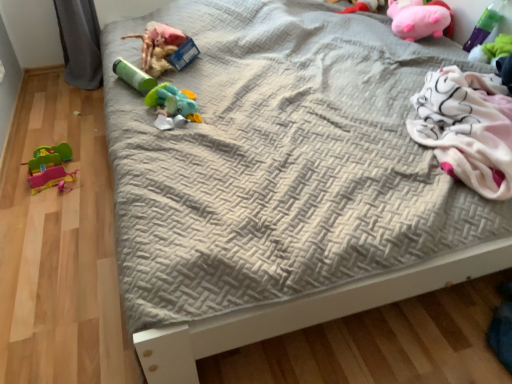
Question: Would you say rubber duck at left, acting as the first toy starting from the left, is part of rubberized green and blue toy at center, the fourth toy in the left-to-right sequence,'s contents?

Choices:
 (A) no
 (B) yes

Answer: (A)

Question: Can you confirm if rubberized green and blue toy at center, the fourth toy in the left-to-right sequence, is shorter than rubber duck at left, acting as the first toy starting from the left?

Choices:
 (A) no
 (B) yes

Answer: (B)

Question: Is rubberized green and blue toy at center, the fourth toy in the left-to-right sequence, far from rubber duck at left, which is the seventh toy in right-to-left order?

Choices:
 (A) yes
 (B) no

Answer: (B)

Question: Does rubberized green and blue toy at center, which is the fourth toy in right-to-left order, have a smaller size compared to rubber duck at left, acting as the first toy starting from the left?

Choices:
 (A) yes
 (B) no

Answer: (A)

Question: Does rubberized green and blue toy at center, the fourth toy in the left-to-right sequence, have a greater width compared to rubber duck at left, which is the seventh toy in right-to-left order?

Choices:
 (A) no
 (B) yes

Answer: (B)

Question: Looking at their shapes, would you say pink plush toy at upper right, which appears as the fifth toy when viewed from the left, is wider or thinner than rubberized green and blue toy at center, which is the fourth toy in right-to-left order?

Choices:
 (A) wide
 (B) thin

Answer: (A)

Question: From the image's perspective, is pink plush toy at upper right, which appears as the fifth toy when viewed from the left, located above or below rubberized green and blue toy at center, the fourth toy in the left-to-right sequence?

Choices:
 (A) below
 (B) above

Answer: (B)

Question: Looking at the image, does pink plush toy at upper right, which appears as the fifth toy when viewed from the left, seem bigger or smaller compared to rubberized green and blue toy at center, the fourth toy in the left-to-right sequence?

Choices:
 (A) small
 (B) big

Answer: (B)

Question: From a real-world perspective, relative to rubberized green and blue toy at center, the fourth toy in the left-to-right sequence, is pink plush toy at upper right, which appears as the fifth toy when viewed from the left, vertically above or below?

Choices:
 (A) below
 (B) above

Answer: (B)

Question: In terms of width, does rubberized green and blue toy at center, the fourth toy in the left-to-right sequence, look wider or thinner when compared to matte green tube at upper left, marked as the fifth toy in a right-to-left arrangement?

Choices:
 (A) thin
 (B) wide

Answer: (A)

Question: From the image's perspective, relative to matte green tube at upper left, marked as the fifth toy in a right-to-left arrangement, is rubberized green and blue toy at center, which is the fourth toy in right-to-left order, above or below?

Choices:
 (A) below
 (B) above

Answer: (A)

Question: Does point (199, 117) appear closer or farther from the camera than point (166, 31)?

Choices:
 (A) farther
 (B) closer

Answer: (B)

Question: Which is correct: rubberized green and blue toy at center, which is the fourth toy in right-to-left order, is inside matte green tube at upper left, which is the 3th toy from left to right, or outside of it?

Choices:
 (A) outside
 (B) inside

Answer: (A)

Question: From the image's perspective, is green matte cylinder at center, the sixth toy from the right, positioned above or below pink plush toy at upper right, which appears as the fifth toy when viewed from the left?

Choices:
 (A) above
 (B) below

Answer: (B)

Question: Is green matte cylinder at center, which is the 2th toy from left to right, inside or outside of pink plush toy at upper right, which appears as the fifth toy when viewed from the left?

Choices:
 (A) inside
 (B) outside

Answer: (B)